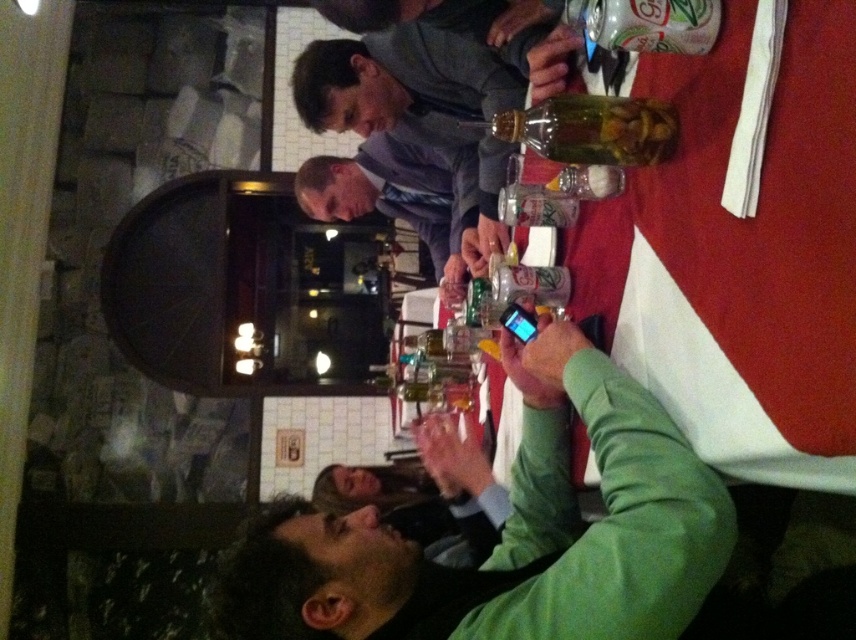
Measure the distance between green matte phone at center and clear glass bottle at upper center.

They are 18.13 inches apart.

Is green matte phone at center shorter than clear glass bottle at upper center?

No, green matte phone at center is not shorter than clear glass bottle at upper center.

Is point (300, 611) more distant than point (635, 109)?

Yes.

What are the coordinates of `green matte phone at center` in the screenshot? It's located at (509, 532).

Between green matte phone at center and matte gray shirt at center, which one has less height?

green matte phone at center is shorter.

Is green matte phone at center above matte gray shirt at center?

No.

This screenshot has height=640, width=856. Identify the location of green matte phone at center. (509, 532).

Consider the image. Is matte gray shirt at center to the right of clear glass bottle at upper center from the viewer's perspective?

Answer: No, matte gray shirt at center is not to the right of clear glass bottle at upper center.

This screenshot has height=640, width=856. Describe the element at coordinates (396, 193) in the screenshot. I see `matte gray shirt at center` at that location.

Which is behind, point (455, 218) or point (587, 122)?

Point (455, 218)

The image size is (856, 640). I want to click on matte gray shirt at center, so click(396, 193).